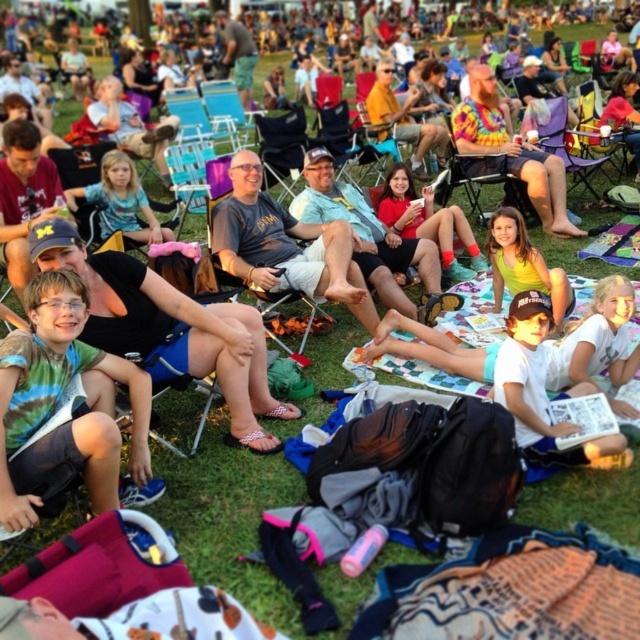
Is matte black shorts at center shorter than white cotton shirt at lower right?

No, matte black shorts at center is not shorter than white cotton shirt at lower right.

The image size is (640, 640). In order to click on matte black shorts at center in this screenshot , I will do `click(285, 244)`.

Who is more forward, [241,228] or [500,394]?

Positioned in front is point [500,394].

Identify the location of matte black shorts at center. The width and height of the screenshot is (640, 640). coord(285,244).

Does striped tie-dye shirt at lower left have a lesser height compared to matte red shirt at center?

No.

Is striped tie-dye shirt at lower left taller than matte red shirt at center?

Correct, striped tie-dye shirt at lower left is much taller as matte red shirt at center.

Where is `striped tie-dye shirt at lower left`? striped tie-dye shirt at lower left is located at coordinates (61, 406).

Is blue-green shirt at center taller than tie-dye shirt at center?

No.

This screenshot has height=640, width=640. What do you see at coordinates (120, 202) in the screenshot?
I see `blue-green shirt at center` at bounding box center [120, 202].

Is point (148, 237) positioned after point (412, 122)?

That is False.

This screenshot has width=640, height=640. I want to click on blue-green shirt at center, so click(120, 202).